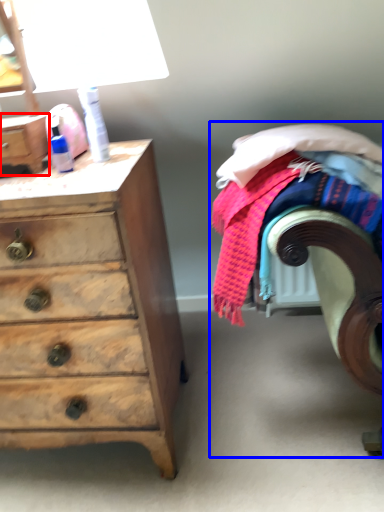
Question: Which object appears farthest to the camera in this image, chest (highlighted by a red box) or bed (highlighted by a blue box)?

Choices:
 (A) chest
 (B) bed

Answer: (A)